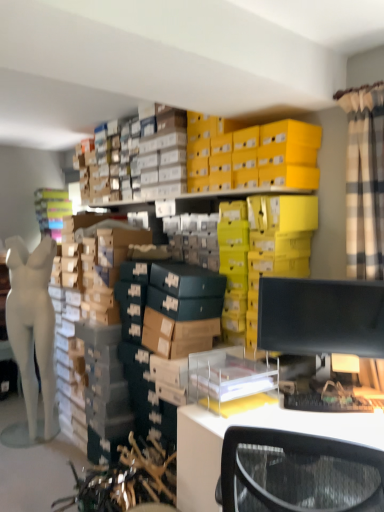
Question: Is white matte mannequin at left taller than white plastic desk at lower right?

Choices:
 (A) no
 (B) yes

Answer: (B)

Question: From a real-world perspective, is white matte mannequin at left physically above white plastic desk at lower right?

Choices:
 (A) no
 (B) yes

Answer: (B)

Question: Is white plastic desk at lower right completely or partially inside white matte mannequin at left?

Choices:
 (A) yes
 (B) no

Answer: (B)

Question: Considering the relative sizes of white matte mannequin at left and white plastic desk at lower right in the image provided, is white matte mannequin at left shorter than white plastic desk at lower right?

Choices:
 (A) yes
 (B) no

Answer: (B)

Question: From a real-world perspective, is white matte mannequin at left physically below white plastic desk at lower right?

Choices:
 (A) no
 (B) yes

Answer: (A)

Question: Does white matte mannequin at left have a larger size compared to white plastic desk at lower right?

Choices:
 (A) yes
 (B) no

Answer: (B)

Question: Is white plastic desk at lower right outside white matte mannequin at left?

Choices:
 (A) yes
 (B) no

Answer: (A)

Question: Would you say white plastic desk at lower right is a long distance from white matte mannequin at left?

Choices:
 (A) yes
 (B) no

Answer: (A)

Question: Is white plastic desk at lower right facing towards white matte mannequin at left?

Choices:
 (A) yes
 (B) no

Answer: (B)

Question: Is white matte mannequin at left at the back of white plastic desk at lower right?

Choices:
 (A) yes
 (B) no

Answer: (B)

Question: Considering the relative sizes of white plastic desk at lower right and white matte mannequin at left in the image provided, is white plastic desk at lower right wider than white matte mannequin at left?

Choices:
 (A) yes
 (B) no

Answer: (A)

Question: Is white plastic desk at lower right touching white matte mannequin at left?

Choices:
 (A) yes
 (B) no

Answer: (B)

Question: Is black matte monitor at right wider than white plastic desk at lower right?

Choices:
 (A) no
 (B) yes

Answer: (A)